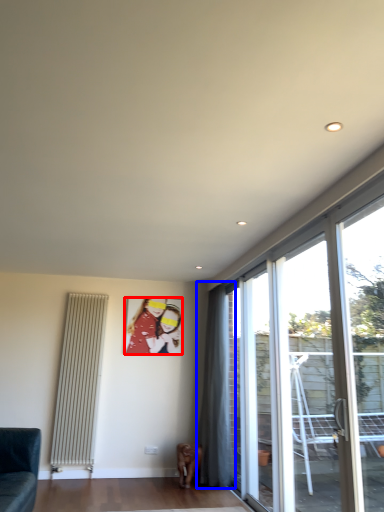
Question: Among these objects, which one is farthest to the camera, art (highlighted by a red box) or curtain (highlighted by a blue box)?

Choices:
 (A) art
 (B) curtain

Answer: (A)